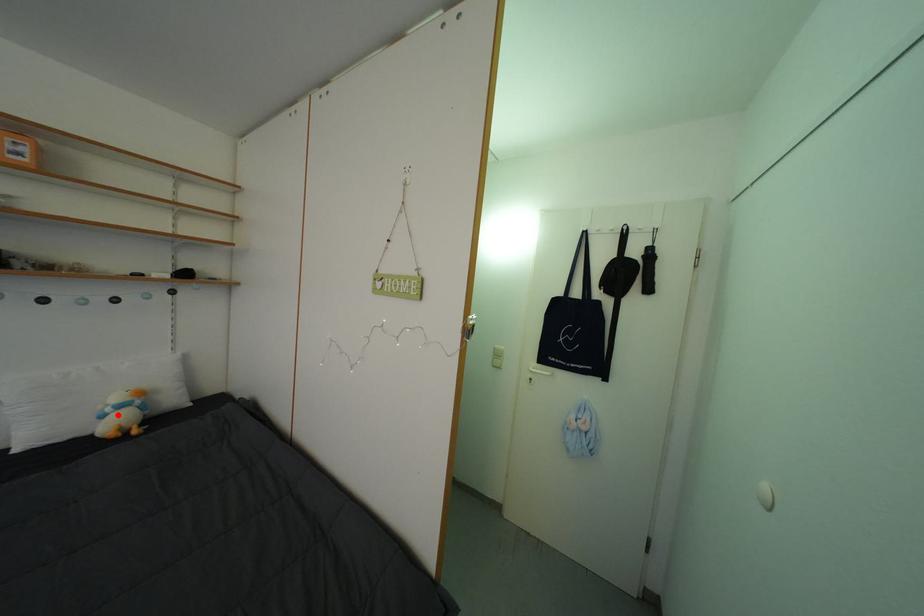
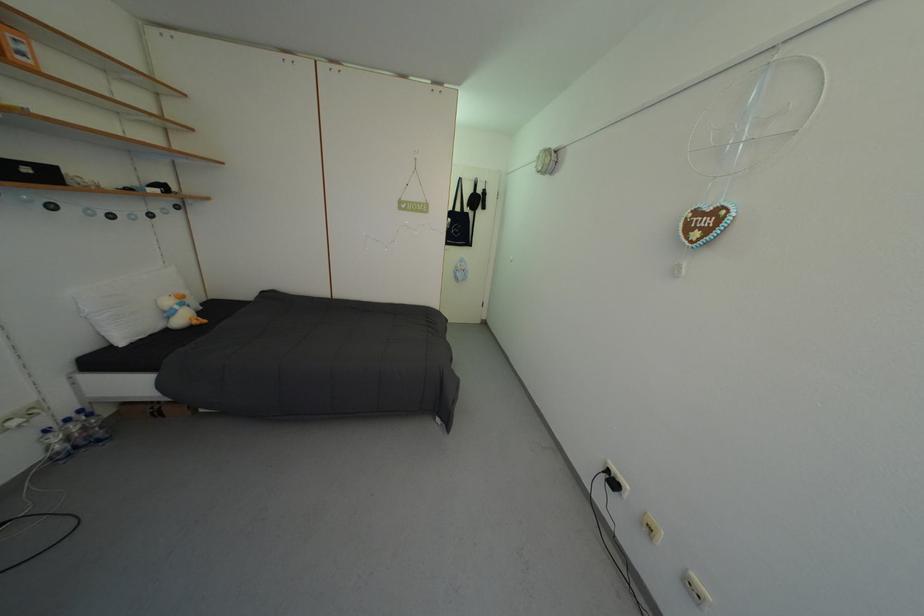
Where in the second image is the point corresponding to the highlighted location from the first image?

(186, 313)